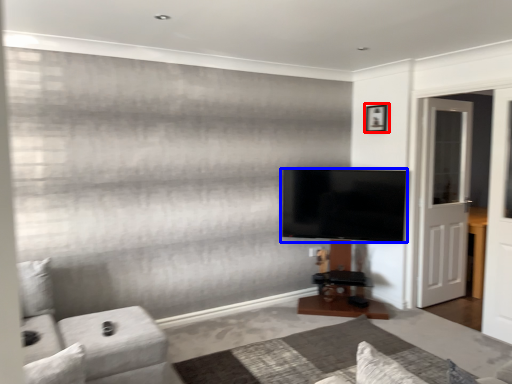
Question: Which object is closer to the camera taking this photo, picture frame (highlighted by a red box) or television (highlighted by a blue box)?

Choices:
 (A) picture frame
 (B) television

Answer: (B)